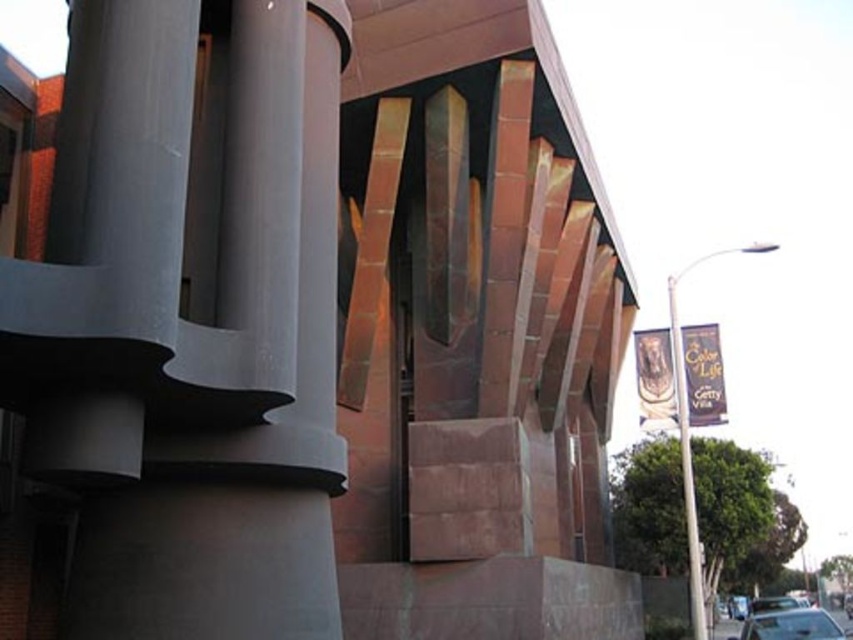
Image resolution: width=853 pixels, height=640 pixels. I want to click on silver metallic pole at right, so click(x=689, y=426).

Can you confirm if silver metallic pole at right is positioned to the right of shiny silver sedan at lower right?

In fact, silver metallic pole at right is to the left of shiny silver sedan at lower right.

Between point (682, 481) and point (830, 627), which one is positioned in front?

Point (830, 627) is more forward.

Where is `silver metallic pole at right`? silver metallic pole at right is located at coordinates (689, 426).

Does silver metallic pole at right lie in front of metallic silver car at lower right?

Yes, it is.

Is point (679, 333) closer to viewer compared to point (763, 604)?

Yes.

Which is behind, point (679, 438) or point (761, 602)?

Point (761, 602)

What are the coordinates of `silver metallic pole at right` in the screenshot? It's located at (689, 426).

Between white metallic pole at right and shiny silver sedan at lower right, which one has more height?

Standing taller between the two is shiny silver sedan at lower right.

Which is in front, point (695, 536) or point (790, 616)?

Point (695, 536)

What do you see at coordinates (686, 460) in the screenshot?
I see `white metallic pole at right` at bounding box center [686, 460].

This screenshot has width=853, height=640. Identify the location of white metallic pole at right. (686, 460).